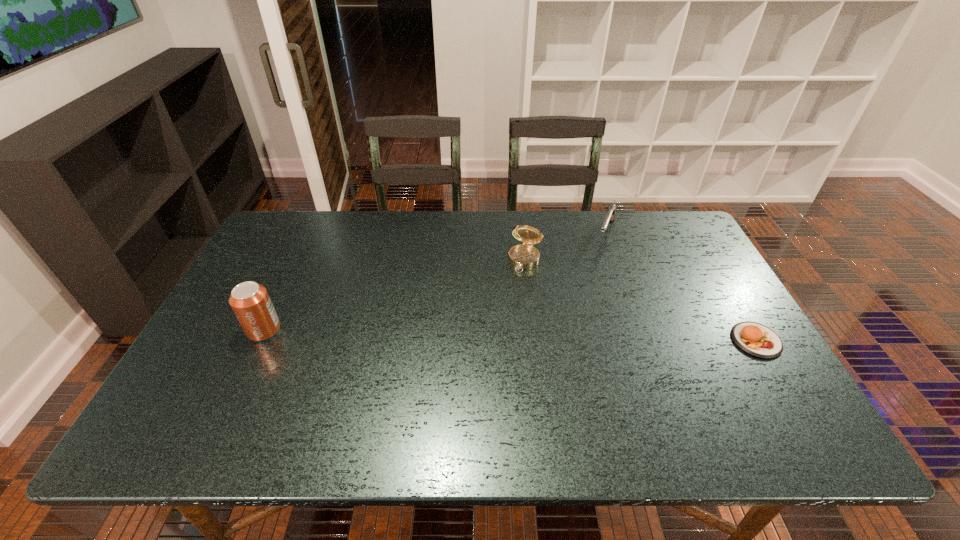
You are a GUI agent. You are given a task and a screenshot of the screen. Output one action in this format:
    pyautogui.click(x=<x>, y=<y>)
    Task: Click on the vacant space located with the dial facing the compass
    Image resolution: width=960 pixels, height=540 pixels.
    Given the screenshot: What is the action you would take?
    pyautogui.click(x=508, y=304)

Find the location of a particular element. Image resolution: width=960 pixels, height=540 pixels. vacant space located 0.230m with the dial facing the compass is located at coordinates (498, 327).

At what (x,y) coordinates should I click in order to perform the action: click on free space located with the dial facing the compass. Please return your answer as a coordinate pair (x, y). The height and width of the screenshot is (540, 960). Looking at the image, I should click on (485, 359).

Image resolution: width=960 pixels, height=540 pixels. In order to click on vacant region located 0.330m aiming along the barrel of the second object from right to left in this screenshot , I will do `click(579, 321)`.

The width and height of the screenshot is (960, 540). Identify the location of free space located aiming along the barrel of the second object from right to left. (589, 292).

Where is `blank area located aiming along the barrel of the second object from right to left`? Image resolution: width=960 pixels, height=540 pixels. blank area located aiming along the barrel of the second object from right to left is located at coordinates 578,323.

Where is `compass that is at the far edge`? This screenshot has width=960, height=540. compass that is at the far edge is located at coordinates (524, 256).

The height and width of the screenshot is (540, 960). I want to click on gun that is at the far edge, so click(610, 216).

Image resolution: width=960 pixels, height=540 pixels. I want to click on object situated at the left edge, so click(250, 302).

You are a GUI agent. You are given a task and a screenshot of the screen. Output one action in this format:
    pyautogui.click(x=<x>, y=<y>)
    Task: Click on the object that is at the right edge
    
    Given the screenshot: What is the action you would take?
    pyautogui.click(x=758, y=340)